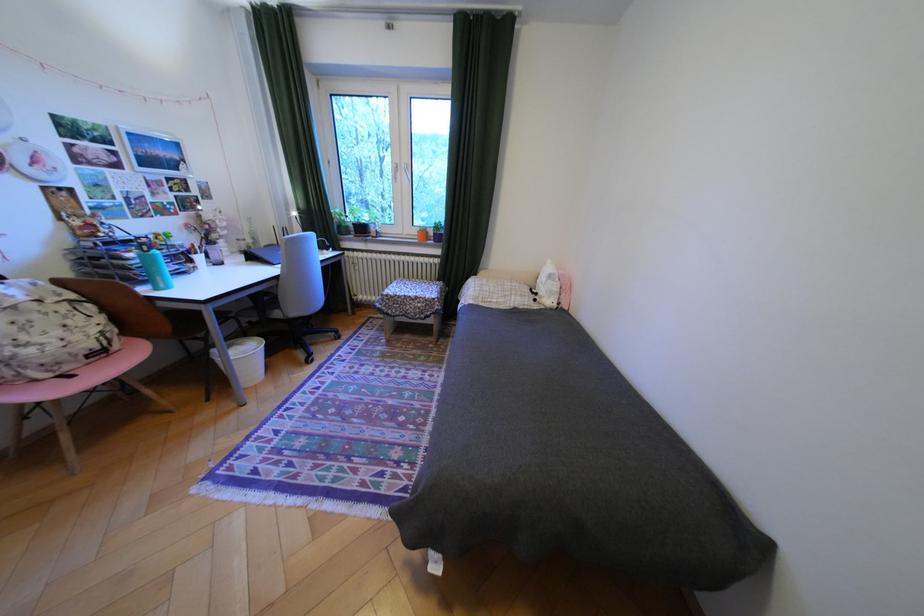
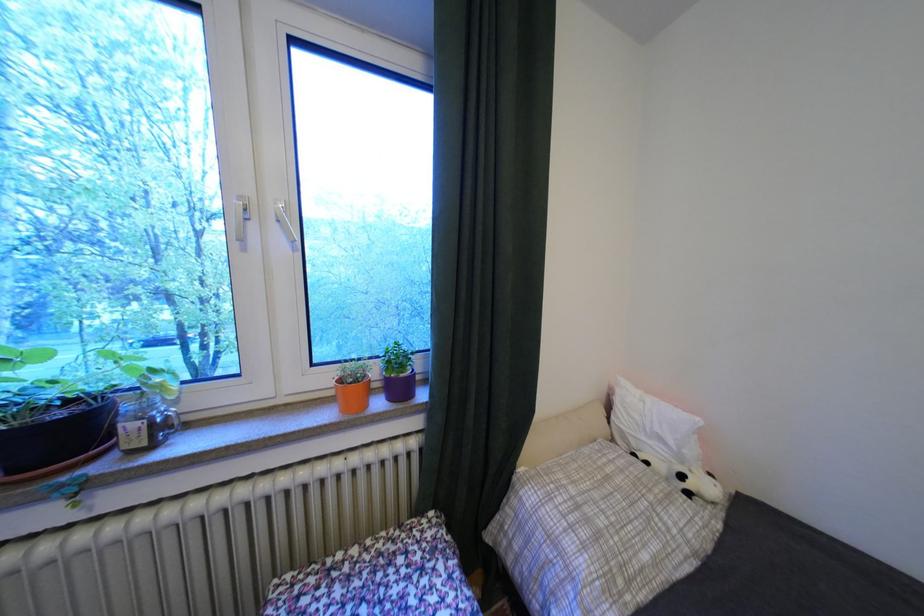
Locate, in the second image, the point that corresponds to (508,302) in the first image.

(667, 562)